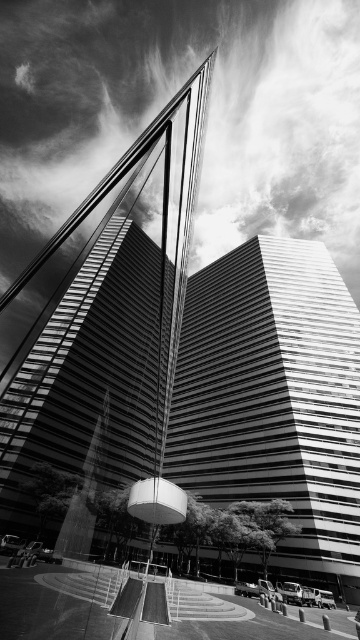
You are a drone operator trying to deliver a package to the smooth glass skyscraper at center. Your drone has a GPS coordinate system where the bottom left corner of the image is the origin point. The target point for delivery is at point (101,328). Can you confirm if the smooth glass skyscraper at center is indeed located at this coordinate?

Yes, the smooth glass skyscraper at center is located at point (101,328) according to the coordinates provided.

You are an architect analyzing the building structure in the image. You notice two central elements labeled as the smooth glass skyscraper at center and the smooth glass tower at center. Based on their spatial arrangement, which one is located higher up in the image?

The smooth glass skyscraper at center is positioned over the smooth glass tower at center, meaning it is higher up in the image.

You are an architect analyzing this image. You notice two structures labeled as smooth glass skyscraper at center and smooth glass tower at center. Based on the scene description, which one is taller?

The smooth glass skyscraper at center is taller than the smooth glass tower at center according to the description.